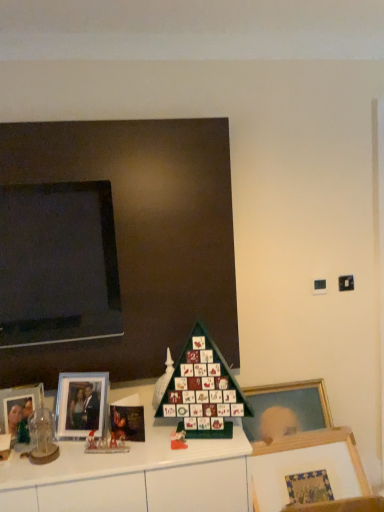
At what (x,y) coordinates should I click in order to perform the action: click on free space to the right of matte plastic advent calendar at center, which ranks as the 1th toy in right-to-left order. Please return your answer as a coordinate pair (x, y). Looking at the image, I should click on (212, 443).